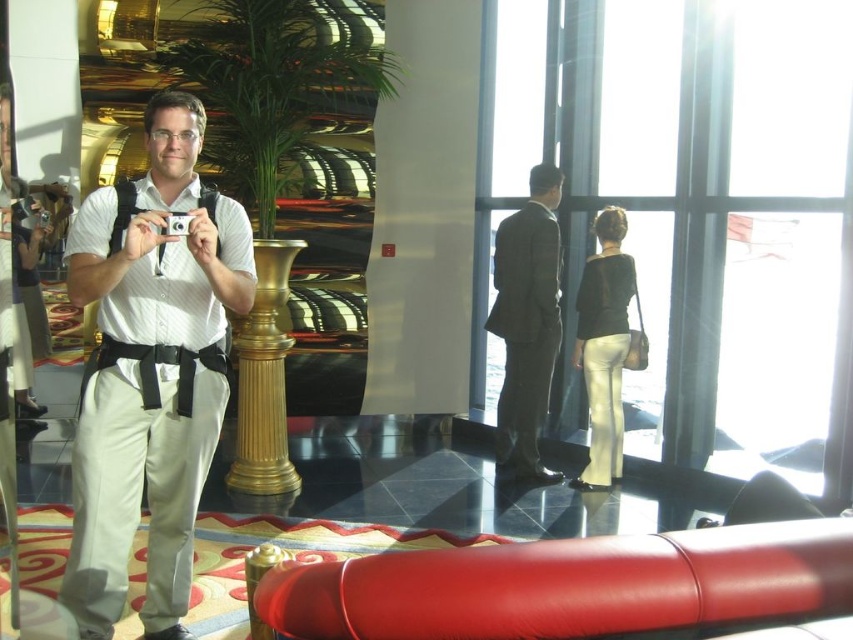
Consider the image. You are a photographer in the scene. You want to ensure that both the white cotton shirt at center and the dark gray suit at center are in focus. Which subject should you adjust your camera focus to prioritize based on their positions?

The white cotton shirt at center has a lesser height compared to dark gray suit at center. Therefore, you should prioritize focusing on the dark gray suit at center since it is taller and might be the main subject.

You are standing in the luxurious indoor setting and want to take a photo of the white cotton shirt at center. Where should you aim your camera to capture it?

You should aim your camera at the point with coordinates 0.578 on the x axis and 0.178 on the y axis to capture the white cotton shirt at center.

You are a photographer in the scene. You want to take a photo of the person wearing a dark suit and hat in the background. However, there is a point at coordinates point (151, 369) that might be in the way. Is this point located on the white cotton shirt at center or somewhere else?

The point (151, 369) is on white cotton shirt at center, so it is located on the white cotton shirt at center.